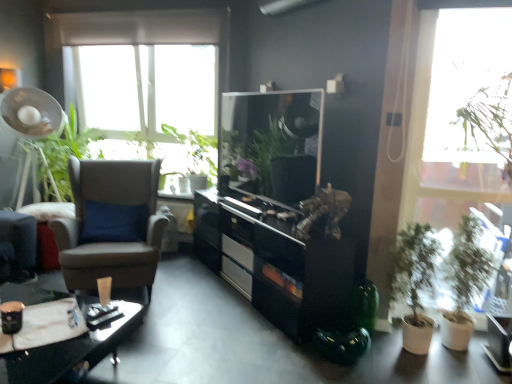
Question: Is green matte plant at right, marked as the 2th houseplant in a left-to-right arrangement, bigger or smaller than green leafy plant at left, the 1th vegetation from the left?

Choices:
 (A) big
 (B) small

Answer: (B)

Question: Relative to green leafy plant at left, which ranks as the second vegetation in right-to-left order, is green matte plant at right, which is counted as the first houseplant, starting from the right, in front or behind?

Choices:
 (A) behind
 (B) front

Answer: (B)

Question: Which object is the closest to the matte black desk at lower left?

Choices:
 (A) green leafy plant at upper center, which is the 1th vegetation from right to left
 (B) black glossy cabinet at center
 (C) transparent glass window at upper right
 (D) brown leather chair at left
 (E) green matte plant at right, which is counted as the first houseplant, starting from the right

Answer: (D)

Question: Estimate the real-world distances between objects in this image. Which object is closer to the green matte plant at right, placed as the 2th houseplant when sorted from right to left?

Choices:
 (A) transparent glass window at upper right
 (B) matte black desk at lower left
 (C) brown leather chair at left
 (D) black glossy cabinet at center
 (E) green leafy plant at upper center, arranged as the second vegetation when viewed from the left

Answer: (A)